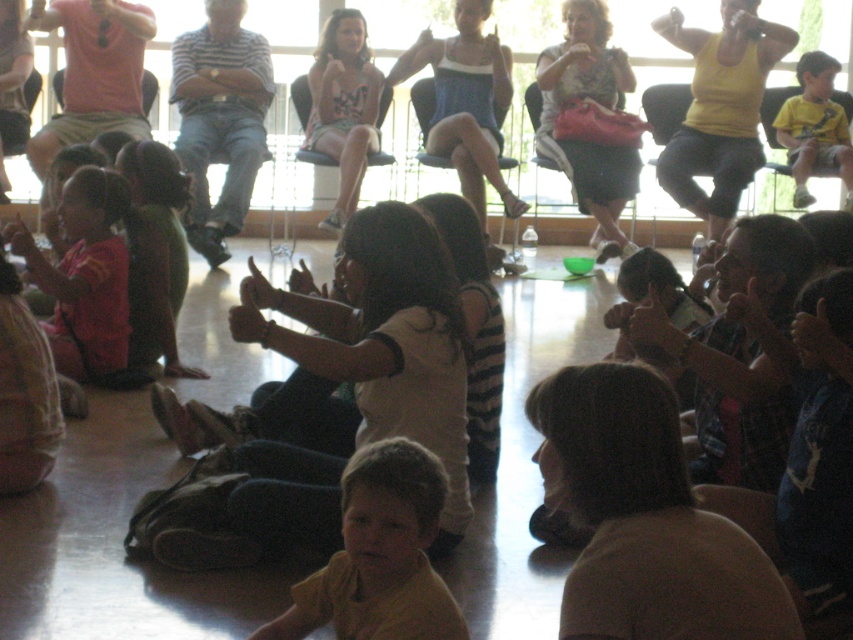
Does matte red shirt at left have a greater height compared to floral dress at center?

No.

Which is below, matte red shirt at left or floral dress at center?

matte red shirt at left is lower down.

Which is in front, point (103, 225) or point (318, 147)?

Point (103, 225)

This screenshot has width=853, height=640. What are the coordinates of `matte red shirt at left` in the screenshot? It's located at (86, 278).

Between striped shirt at center and yellow matte shirt at upper right, which one appears on the left side from the viewer's perspective?

From the viewer's perspective, striped shirt at center appears more on the left side.

Does point (200, 67) come farther from viewer compared to point (816, 145)?

Yes, point (200, 67) is farther from viewer.

Find the location of a particular element. The image size is (853, 640). striped shirt at center is located at coordinates (219, 120).

Between point (389, 285) and point (465, 156), which one is positioned in front?

Point (389, 285) is in front.

Does white striped shirt at center have a greater height compared to white tank top at upper center?

Incorrect, white striped shirt at center's height is not larger of white tank top at upper center's.

Between point (409, 208) and point (486, 104), which one is positioned behind?

Point (486, 104)

Identify the location of white striped shirt at center. The height and width of the screenshot is (640, 853). (383, 339).